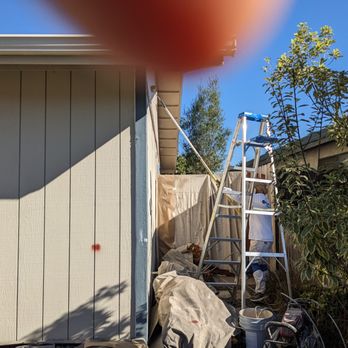
Locate an element on the screen. This screenshot has height=348, width=348. shadow on door cast by trees is located at coordinates (86, 326).